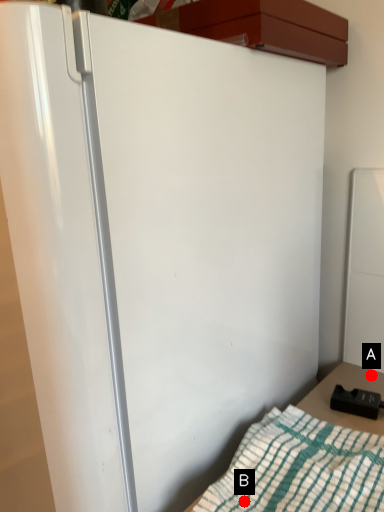
Question: Two points are circled on the image, labeled by A and B beside each circle. Which point is closer to the camera taking this photo?

Choices:
 (A) A is closer
 (B) B is closer

Answer: (B)